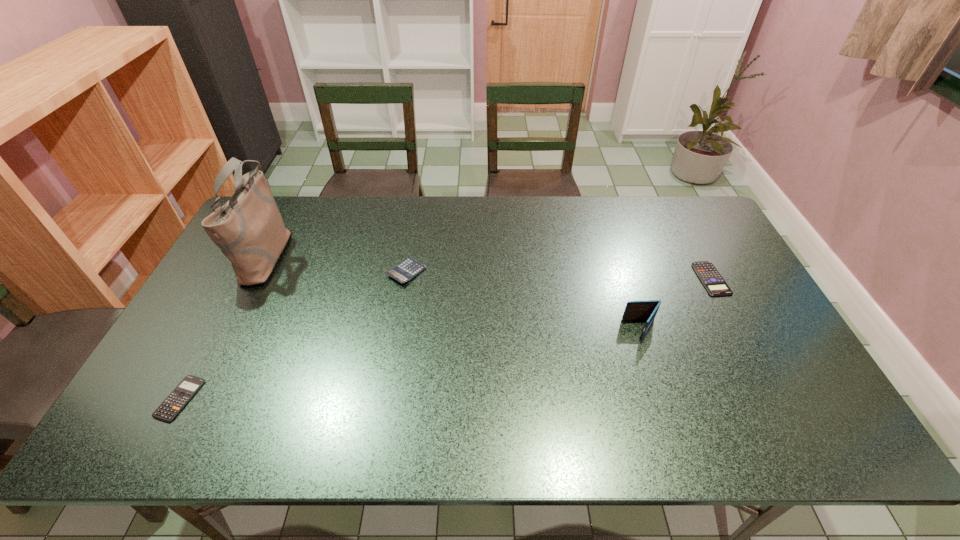
This screenshot has height=540, width=960. I want to click on the tallest object, so click(x=249, y=230).

Image resolution: width=960 pixels, height=540 pixels. What are the coordinates of `wallet` in the screenshot? It's located at (648, 309).

This screenshot has height=540, width=960. What are the coordinates of `the second tallest object` in the screenshot? It's located at (648, 309).

At what (x,y) coordinates should I click in order to perform the action: click on the tallest calculator. Please return your answer as a coordinate pair (x, y). Looking at the image, I should click on (409, 268).

The image size is (960, 540). What are the coordinates of `the third shortest object` in the screenshot? It's located at (409, 268).

The width and height of the screenshot is (960, 540). I want to click on the fourth tallest object, so click(x=712, y=280).

At what (x,y) coordinates should I click in order to perform the action: click on the rightmost calculator. Please return your answer as a coordinate pair (x, y). The image size is (960, 540). Looking at the image, I should click on 712,280.

Identify the location of the nearest object. The height and width of the screenshot is (540, 960). (186, 389).

The height and width of the screenshot is (540, 960). Find the location of `the shortest calculator`. the shortest calculator is located at coordinates coord(186,389).

Locate an element on the screen. Image resolution: width=960 pixels, height=540 pixels. vacant space positioned on the front-facing side of the tallest object is located at coordinates (313, 254).